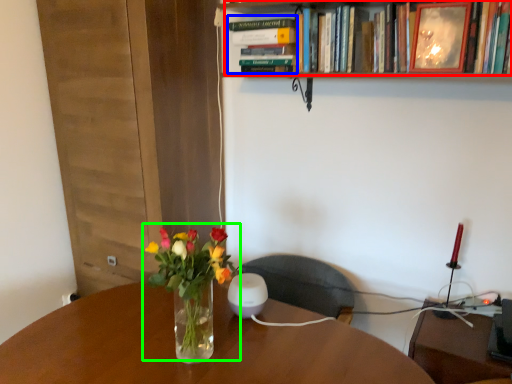
Question: Which object is positioned farthest from book (highlighted by a red box)? Select from book (highlighted by a blue box) and floral arrangement (highlighted by a green box).

Choices:
 (A) book
 (B) floral arrangement

Answer: (B)